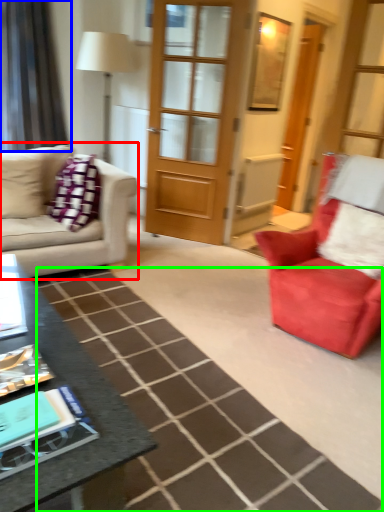
Question: Considering the real-world distances, which object is closest to studio couch (highlighted by a red box)? curtain (highlighted by a blue box) or plain (highlighted by a green box).

Choices:
 (A) curtain
 (B) plain

Answer: (B)